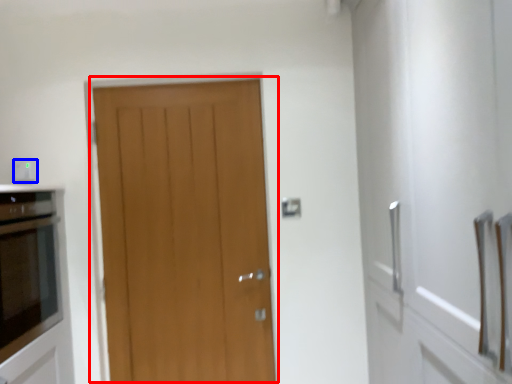
Question: Which object is closer to the camera taking this photo, door (highlighted by a red box) or electric outlet (highlighted by a blue box)?

Choices:
 (A) door
 (B) electric outlet

Answer: (B)